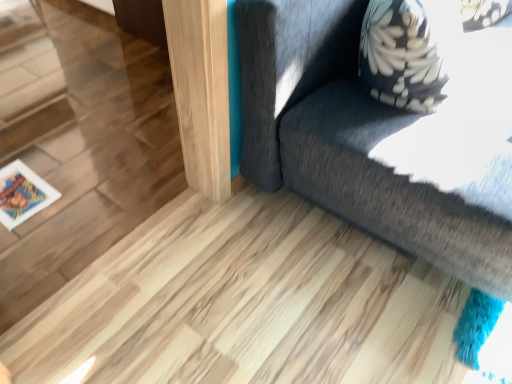
Question: Does point (495, 62) appear closer or farther from the camera than point (13, 190)?

Choices:
 (A) closer
 (B) farther

Answer: (A)

Question: From a real-world perspective, is dark gray fabric couch at upper right above or below wooden frame at lower left?

Choices:
 (A) above
 (B) below

Answer: (A)

Question: From the image's perspective, is dark gray fabric couch at upper right located above or below wooden frame at lower left?

Choices:
 (A) below
 (B) above

Answer: (B)

Question: Would you say wooden frame at lower left is to the left or to the right of dark gray fabric couch at upper right in the picture?

Choices:
 (A) right
 (B) left

Answer: (B)

Question: Relative to dark gray fabric couch at upper right, is wooden frame at lower left in front or behind?

Choices:
 (A) front
 (B) behind

Answer: (B)

Question: From a real-world perspective, is wooden frame at lower left positioned above or below dark gray fabric couch at upper right?

Choices:
 (A) above
 (B) below

Answer: (B)

Question: Is point (12, 188) positioned closer to the camera than point (423, 195)?

Choices:
 (A) closer
 (B) farther

Answer: (B)